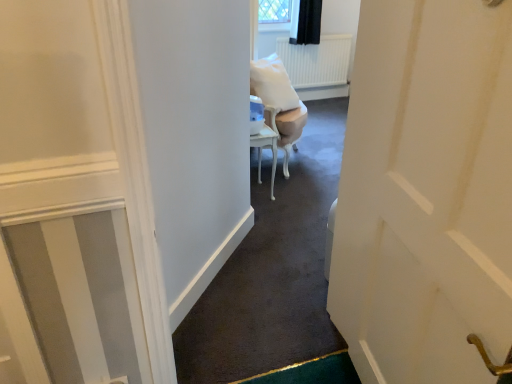
Find the location of a particular element. unoccupied area in front of white glossy table at center is located at coordinates (268, 206).